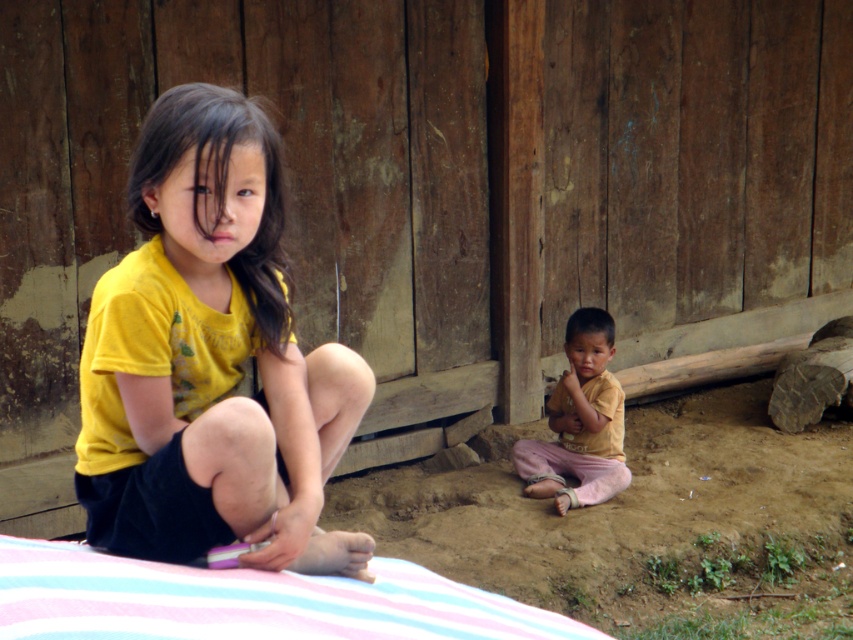
Question: Is yellow matte shirt at left closer to the viewer compared to yellow cotton shirt at lower right?

Choices:
 (A) yes
 (B) no

Answer: (A)

Question: Estimate the real-world distances between objects in this image. Which object is farther from the yellow matte shirt at left?

Choices:
 (A) yellow cotton shirt at lower right
 (B) pink striped fabric at lower left

Answer: (A)

Question: Among these points, which one is farthest from the camera?

Choices:
 (A) 575,428
 (B) 341,609

Answer: (A)

Question: Which of the following is the closest to the observer?

Choices:
 (A) yellow matte shirt at left
 (B) yellow cotton shirt at lower right

Answer: (A)

Question: Is yellow matte shirt at left in front of yellow cotton shirt at lower right?

Choices:
 (A) no
 (B) yes

Answer: (B)

Question: Is yellow matte shirt at left to the left of yellow cotton shirt at lower right from the viewer's perspective?

Choices:
 (A) yes
 (B) no

Answer: (A)